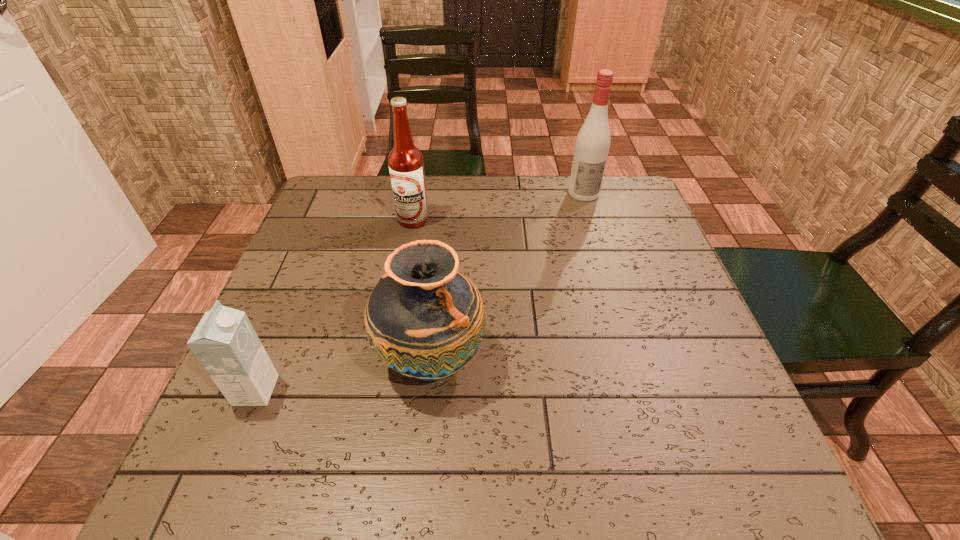
Where is `vacant space located 0.370m on the front label of the leftmost object`? The width and height of the screenshot is (960, 540). vacant space located 0.370m on the front label of the leftmost object is located at coordinates (480, 390).

Image resolution: width=960 pixels, height=540 pixels. Identify the location of object that is at the left edge. (225, 343).

Where is `object situated at the right edge`? Image resolution: width=960 pixels, height=540 pixels. object situated at the right edge is located at coordinates (593, 140).

Where is `object at the far right corner`? This screenshot has width=960, height=540. object at the far right corner is located at coordinates (593, 140).

In the image, there is a desktop. Identify the location of blank space at the far edge. (495, 215).

The height and width of the screenshot is (540, 960). What are the coordinates of `vacant region at the near edge of the desktop` in the screenshot? It's located at (422, 441).

In the image, there is a desktop. At what (x,y) coordinates should I click in order to perform the action: click on vacant space at the left edge. Please return your answer as a coordinate pair (x, y). Image resolution: width=960 pixels, height=540 pixels. Looking at the image, I should click on (327, 345).

At what (x,y) coordinates should I click in order to perform the action: click on free space at the right edge of the desktop. Please return your answer as a coordinate pair (x, y). This screenshot has height=540, width=960. Looking at the image, I should click on (629, 231).

Locate an element on the screen. This screenshot has height=540, width=960. vacant space at the near left corner is located at coordinates (235, 470).

Where is `vacant space at the far right corner of the desktop`? The image size is (960, 540). vacant space at the far right corner of the desktop is located at coordinates (641, 200).